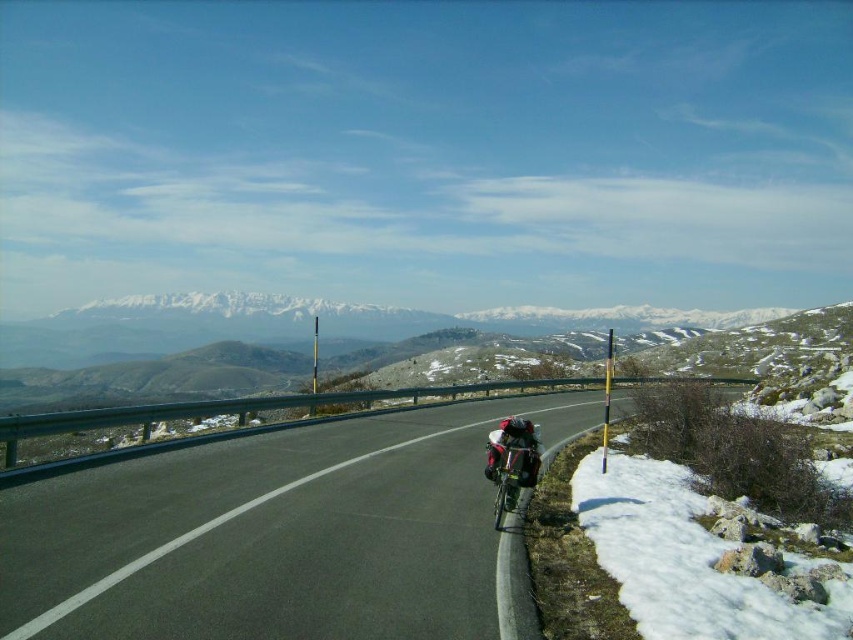
Question: Which point is closer to the camera?

Choices:
 (A) asphalt road at center
 (B) shiny metallic backpack at center

Answer: (A)

Question: In this image, where is asphalt road at center located relative to shiny metallic backpack at center?

Choices:
 (A) right
 (B) left

Answer: (B)

Question: Is asphalt road at center below shiny metallic backpack at center?

Choices:
 (A) no
 (B) yes

Answer: (B)

Question: Which point is closer to the camera taking this photo?

Choices:
 (A) (517, 440)
 (B) (457, 435)

Answer: (A)

Question: Does asphalt road at center have a smaller size compared to shiny metallic backpack at center?

Choices:
 (A) yes
 (B) no

Answer: (B)